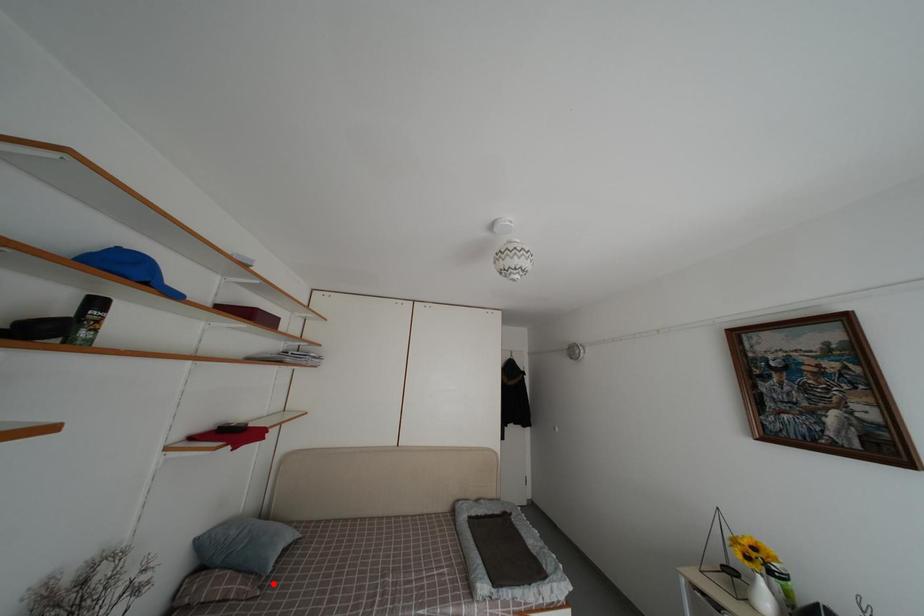
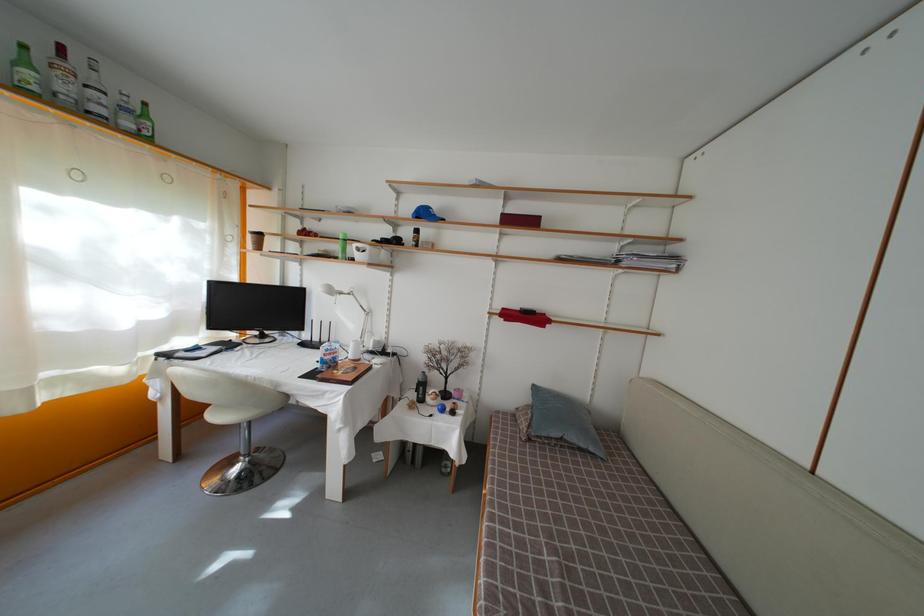
Question: I am providing you with two images of the same scene from different viewpoints. A red point is shown in image1. For the corresponding object point in image2, is it positioned nearer or farther from the camera?

Choices:
 (A) Nearer
 (B) Farther

Answer: (B)